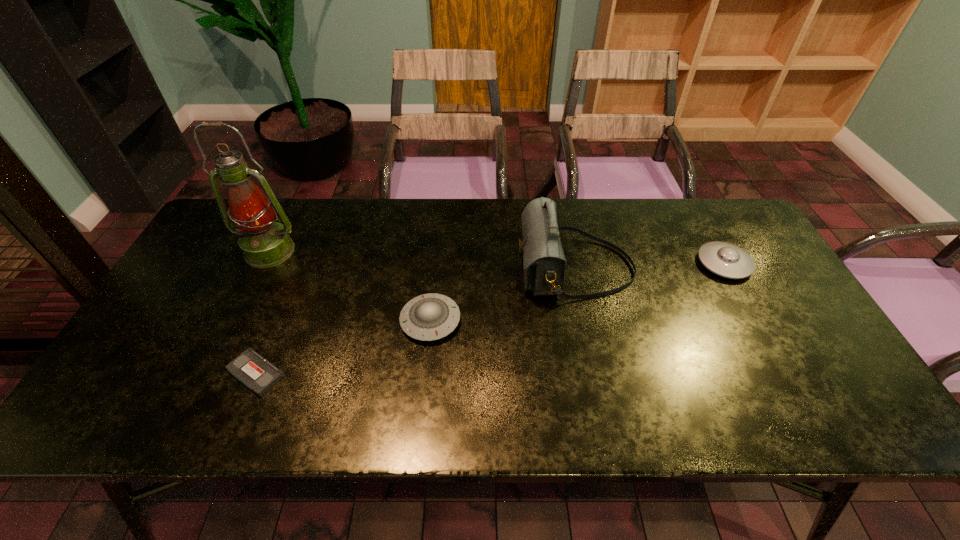
Find the location of a particular element. The image size is (960, 540). the tallest object is located at coordinates (265, 243).

Locate an element on the screen. This screenshot has width=960, height=540. shoulder bag is located at coordinates (544, 263).

Where is `the fourth shortest object`? Image resolution: width=960 pixels, height=540 pixels. the fourth shortest object is located at coordinates (544, 263).

What are the coordinates of `the third tallest object` in the screenshot? It's located at (727, 260).

The width and height of the screenshot is (960, 540). I want to click on the right saucer, so click(727, 260).

Identify the location of the nearer saucer. This screenshot has height=540, width=960. (432, 316).

Where is `the third object from left to right`? This screenshot has width=960, height=540. the third object from left to right is located at coordinates (432, 316).

Identify the location of videotape. (253, 370).

At what (x,y) coordinates should I click in order to perform the action: click on the nearest object. Please return your answer as a coordinate pair (x, y). Looking at the image, I should click on (253, 370).

Find the location of a particular element. free location located 0.110m on the back of the tallest object is located at coordinates (288, 213).